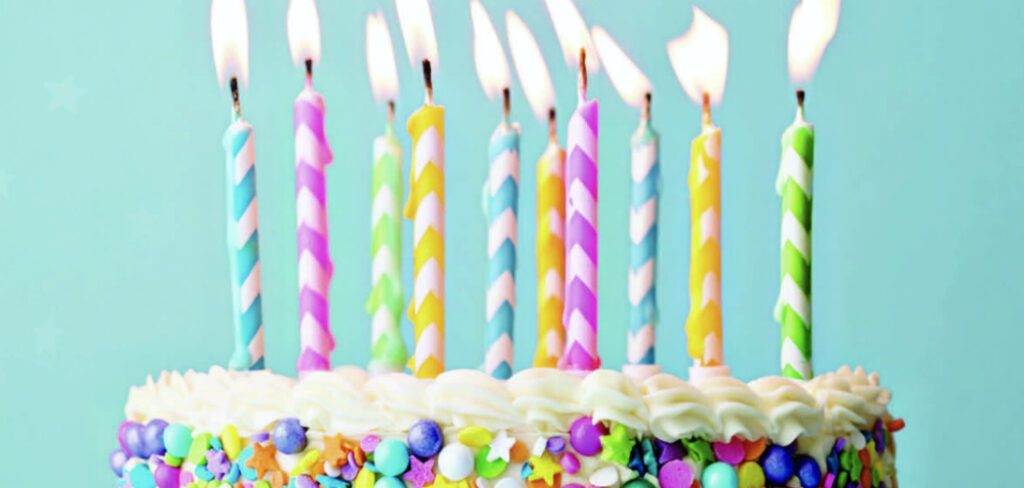
Where is `candles`? candles is located at coordinates (246, 206), (309, 211), (384, 214), (426, 211), (499, 211), (551, 215), (579, 210), (645, 208), (708, 202), (765, 205).